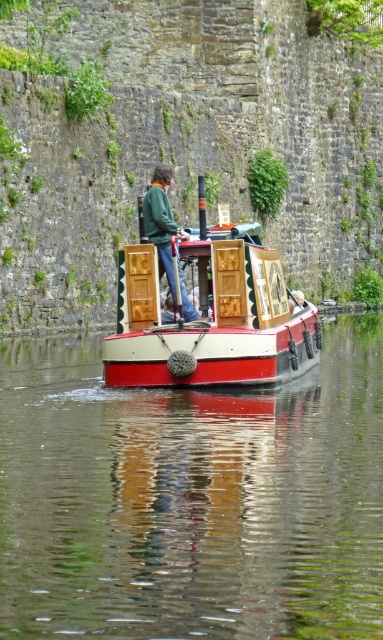
Does point (129, 252) lie in front of point (163, 230)?

Yes, it is.

Between wooden cabin cruiser at center and green matte jacket at center, which one is positioned higher?

green matte jacket at center is above.

Identify the location of wooden cabin cruiser at center. This screenshot has height=640, width=383. (209, 307).

Based on the photo, does smooth glossy water at center lie in front of wooden cabin cruiser at center?

Yes.

I want to click on smooth glossy water at center, so click(x=191, y=499).

Is point (52, 394) positioned before point (165, 209)?

No, it is not.

How distant is smooth glossy water at center from green matte jacket at center?

smooth glossy water at center is 12.91 meters away from green matte jacket at center.

What do you see at coordinates (191, 499) in the screenshot?
I see `smooth glossy water at center` at bounding box center [191, 499].

Locate an element on the screen. Image resolution: width=383 pixels, height=640 pixels. smooth glossy water at center is located at coordinates (191, 499).